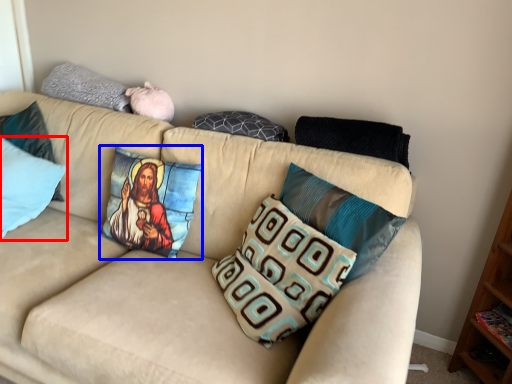
Question: Which of the following is the closest to the observer, pillow (highlighted by a red box) or pillow (highlighted by a blue box)?

Choices:
 (A) pillow
 (B) pillow

Answer: (B)